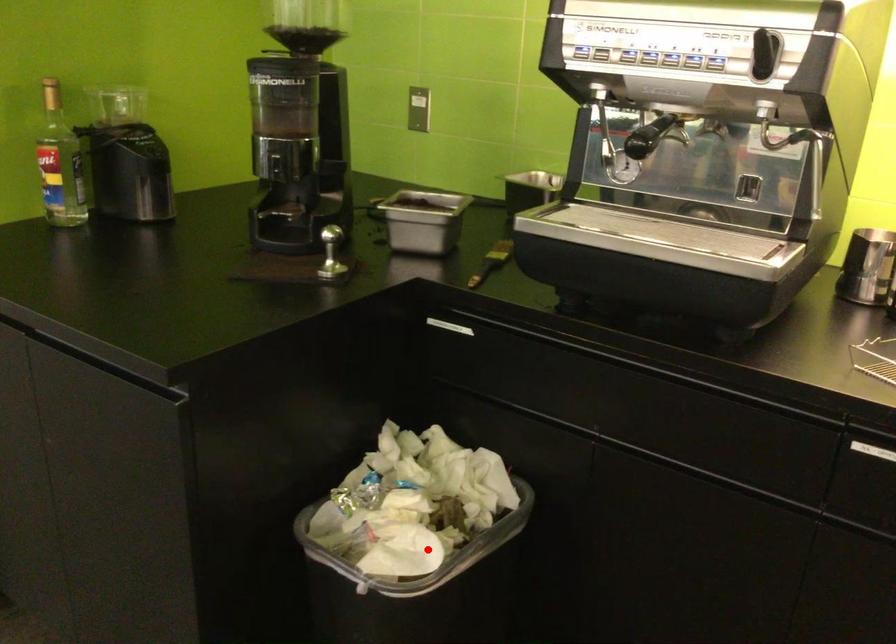
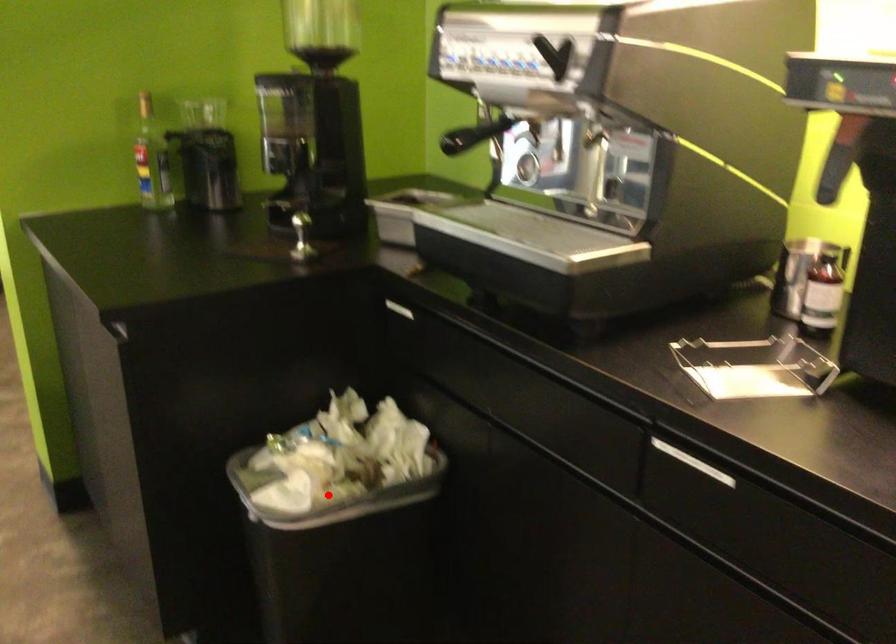
I am providing you with two images of the same scene from different viewpoints. A red point is marked on the first image and another point is marked on the second image. Is the marked point in image1 the same physical position as the marked point in image2?

Yes